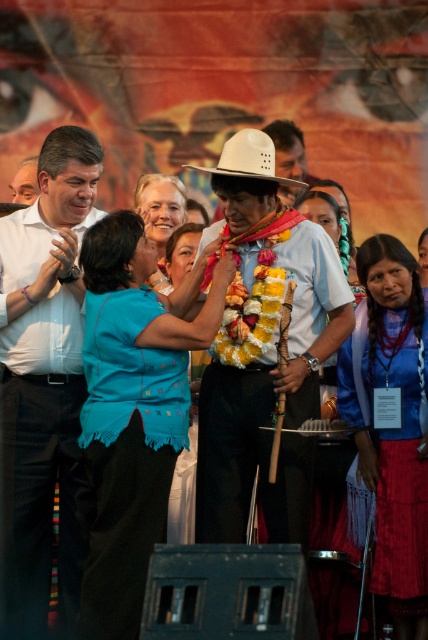
Based on the scene described, which object is closer to the viewer between the white shirt at left and the matte white shirt at center?

The white shirt at left is closer to the viewer as it is positioned in front of the matte white shirt at center.

You are a photographer trying to capture the central figure wearing a traditional white hat in the scene. Given that the point at coordinates (264, 353) marks the location of the white matte hat at center, can you determine if this point is suitable for focusing your camera to ensure the hat is in the frame?

The point at coordinates (264, 353) marks the location of the white matte hat at center, so yes, focusing your camera on this point will ensure the hat is in the frame.